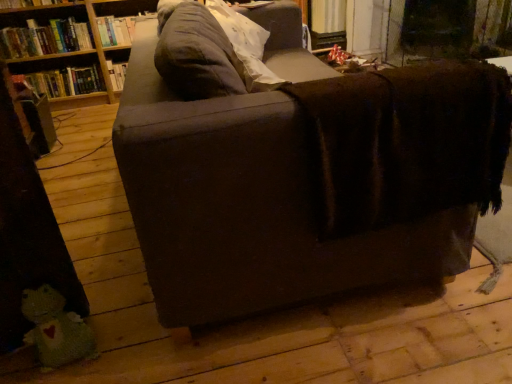
Question: Is soft gray pillow at upper center to the left of green knitted toy at lower left from the viewer's perspective?

Choices:
 (A) yes
 (B) no

Answer: (B)

Question: Can you confirm if soft gray pillow at upper center is smaller than green knitted toy at lower left?

Choices:
 (A) yes
 (B) no

Answer: (B)

Question: From the image's perspective, is soft gray pillow at upper center located beneath green knitted toy at lower left?

Choices:
 (A) no
 (B) yes

Answer: (A)

Question: Is soft gray pillow at upper center beside green knitted toy at lower left?

Choices:
 (A) no
 (B) yes

Answer: (A)

Question: Is green knitted toy at lower left completely or partially inside soft gray pillow at upper center?

Choices:
 (A) no
 (B) yes

Answer: (A)

Question: Is the depth of soft gray pillow at upper center less than that of green knitted toy at lower left?

Choices:
 (A) yes
 (B) no

Answer: (B)

Question: From the image's perspective, is brown fabric shelf at upper left located above hardcover book at upper left, which ranks as the 2th book in top-to-bottom order?

Choices:
 (A) yes
 (B) no

Answer: (A)

Question: Can you confirm if brown fabric shelf at upper left is bigger than hardcover book at upper left, which ranks as the 2th book in top-to-bottom order?

Choices:
 (A) yes
 (B) no

Answer: (A)

Question: Could you tell me if brown fabric shelf at upper left is facing hardcover book at upper left, the second book from the bottom?

Choices:
 (A) yes
 (B) no

Answer: (A)

Question: From a real-world perspective, is brown fabric shelf at upper left on hardcover book at upper left, which ranks as the 2th book in top-to-bottom order?

Choices:
 (A) no
 (B) yes

Answer: (A)

Question: Considering the relative sizes of brown fabric shelf at upper left and hardcover book at upper left, the second book from the bottom, in the image provided, is brown fabric shelf at upper left thinner than hardcover book at upper left, the second book from the bottom,?

Choices:
 (A) no
 (B) yes

Answer: (A)

Question: Is brown fabric shelf at upper left wider than hardcover book at upper left, which ranks as the 2th book in top-to-bottom order?

Choices:
 (A) yes
 (B) no

Answer: (A)

Question: Is hardcover book at left, the third book in the top-to-bottom sequence, at the left side of hardcover book at upper left, the second book from the bottom?

Choices:
 (A) no
 (B) yes

Answer: (A)